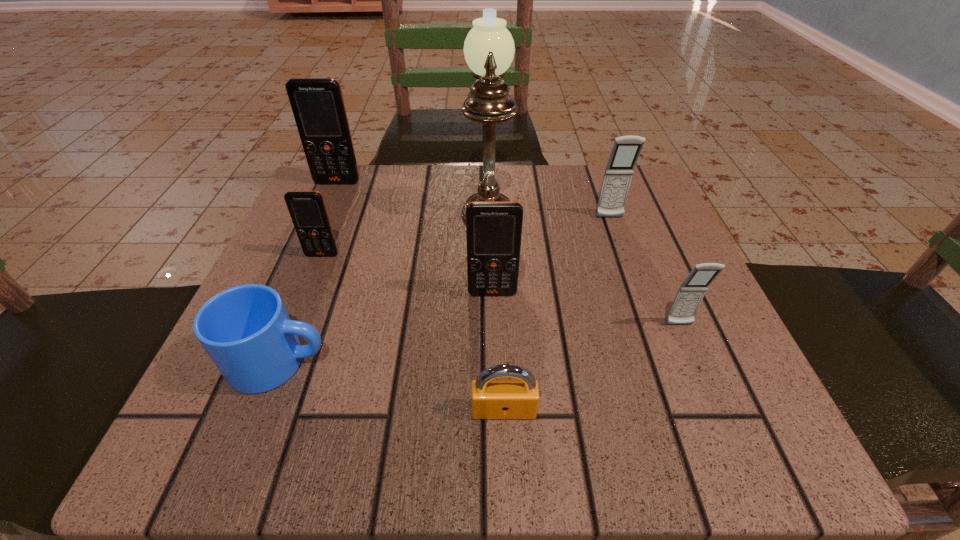
Image resolution: width=960 pixels, height=540 pixels. What are the coordinates of `the right gray cellular telephone` in the screenshot? It's located at (690, 294).

Where is `the seventh farthest object`? the seventh farthest object is located at coordinates (246, 331).

Locate an element on the screen. the nearest object is located at coordinates (491, 398).

This screenshot has height=540, width=960. I want to click on vacant point located on the left of the tallest object, so click(x=306, y=198).

Identify the location of vacant point located 0.210m on the screen of the farthest orange cellular telephone. (310, 247).

Image resolution: width=960 pixels, height=540 pixels. Find the location of `vacant space located 0.070m on the front-facing side of the left gray cellular telephone`. vacant space located 0.070m on the front-facing side of the left gray cellular telephone is located at coordinates (619, 244).

Image resolution: width=960 pixels, height=540 pixels. In order to click on free space located 0.250m on the screen of the second nearest cellular telephone in this screenshot , I will do `click(497, 445)`.

The height and width of the screenshot is (540, 960). What are the coordinates of `free space located on the screen of the fourth farthest object` in the screenshot? It's located at (277, 370).

This screenshot has height=540, width=960. What are the coordinates of `free space located 0.150m on the front-facing side of the nearest cellular telephone` in the screenshot? It's located at (719, 420).

At what (x,y) coordinates should I click in order to perform the action: click on vacant position located 0.370m on the side of the mug with the handle. Please return your answer as a coordinate pair (x, y). Image resolution: width=960 pixels, height=540 pixels. Looking at the image, I should click on coord(588,362).